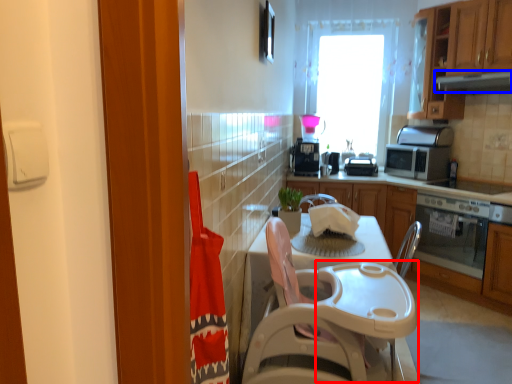
Question: Which object is closer to the camera taking this photo, table (highlighted by a red box) or exhaust hood (highlighted by a blue box)?

Choices:
 (A) table
 (B) exhaust hood

Answer: (A)